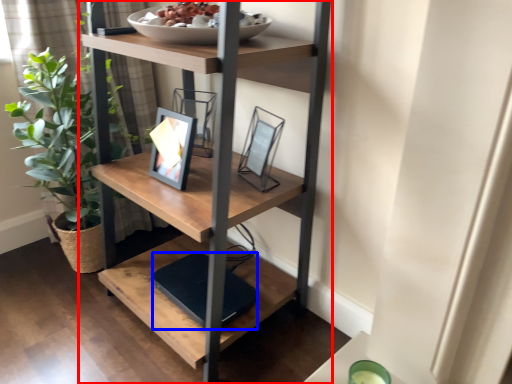
Question: Which object is closer to the camera taking this photo, shelf (highlighted by a red box) or lift (highlighted by a blue box)?

Choices:
 (A) shelf
 (B) lift

Answer: (A)